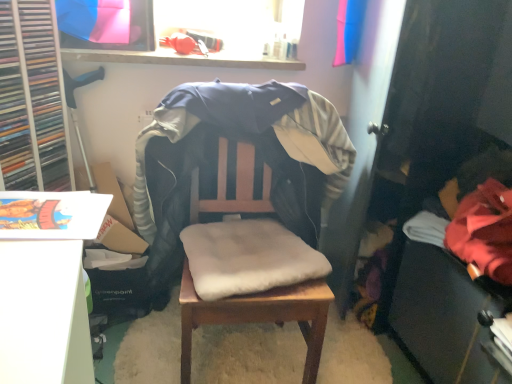
Where is `wooden chair with cushion at center`? The image size is (512, 384). wooden chair with cushion at center is located at coordinates (259, 316).

The image size is (512, 384). I want to click on soft beige cushion at center, so click(x=237, y=140).

The image size is (512, 384). Describe the element at coordinates (484, 231) in the screenshot. I see `red fleece jacket at lower right` at that location.

What is the approximate height of red fleece jacket at lower right?

red fleece jacket at lower right is 22.79 centimeters tall.

Find the location of a particular element. The width and height of the screenshot is (512, 384). wooden table at center is located at coordinates (259, 316).

From the image's perspective, does red fleece jacket at lower right appear lower than wooden chair with cushion at center?

Actually, red fleece jacket at lower right appears above wooden chair with cushion at center in the image.

Is red fleece jacket at lower right not inside wooden chair with cushion at center?

Yes.

Between point (481, 193) and point (305, 304), which one is positioned behind?

Positioned behind is point (481, 193).

Locate an element on the screen. The width and height of the screenshot is (512, 384). bean bag chair above the red fleece jacket at lower right (from the image's perspective) is located at coordinates (237, 140).

Is red fleece jacket at lower right facing away from soft beige cushion at center?

No, soft beige cushion at center is not at the back of red fleece jacket at lower right.

Can you confirm if red fleece jacket at lower right is positioned to the left of soft beige cushion at center?

Incorrect, red fleece jacket at lower right is not on the left side of soft beige cushion at center.

Is red fleece jacket at lower right not close to soft beige cushion at center?

That's not correct — red fleece jacket at lower right is a little close to soft beige cushion at center.

From a real-world perspective, is wooden table at center physically located above or below soft beige cushion at center?

Clearly, from a real-world perspective, wooden table at center is below soft beige cushion at center.

The image size is (512, 384). What are the coordinates of `table below the soft beige cushion at center (from a real-world perspective)` in the screenshot? It's located at (259, 316).

Considering the positions of point (269, 300) and point (318, 113), is point (269, 300) closer or farther from the camera than point (318, 113)?

Point (269, 300) is positioned closer to the camera compared to point (318, 113).

From the image's perspective, would you say wooden table at center is positioned over soft beige cushion at center?

Incorrect, from the image's perspective, wooden table at center is lower than soft beige cushion at center.

Is soft beige cushion at center touching red fleece jacket at lower right?

No.

Between soft beige cushion at center and red fleece jacket at lower right, which one has more height?

Standing taller between the two is soft beige cushion at center.

Is red fleece jacket at lower right at the back of soft beige cushion at center?

No, soft beige cushion at center's orientation is not away from red fleece jacket at lower right.

From a real-world perspective, which is physically above, soft beige cushion at center or red fleece jacket at lower right?

red fleece jacket at lower right.

From the image's perspective, who appears lower, soft beige cushion at center or wooden chair with cushion at center?

From the image's view, wooden chair with cushion at center is below.

Is soft beige cushion at center facing towards wooden chair with cushion at center?

Yes, soft beige cushion at center is oriented towards wooden chair with cushion at center.

Which of these two, soft beige cushion at center or wooden chair with cushion at center, is thinner?

With smaller width is soft beige cushion at center.

Is soft beige cushion at center with wooden chair with cushion at center?

No, soft beige cushion at center is not in contact with wooden chair with cushion at center.

Is point (160, 252) less distant than point (223, 306)?

That is False.

Based on the photo, does soft beige cushion at center come in front of wooden table at center?

Yes, soft beige cushion at center is in front of wooden table at center.

From a real-world perspective, between soft beige cushion at center and wooden table at center, who is vertically lower?

wooden table at center, from a real-world perspective.

Are soft beige cushion at center and wooden table at center located far from each other?

No, there isn't a large distance between soft beige cushion at center and wooden table at center.

Considering the sizes of objects wooden chair with cushion at center and wooden table at center in the image provided, who is shorter, wooden chair with cushion at center or wooden table at center?

wooden table at center is shorter.

Are wooden chair with cushion at center and wooden table at center far apart?

No.

Considering the relative sizes of wooden chair with cushion at center and wooden table at center in the image provided, is wooden chair with cushion at center smaller than wooden table at center?

Actually, wooden chair with cushion at center might be larger than wooden table at center.

Is wooden chair with cushion at center at the left side of wooden table at center?

No, wooden chair with cushion at center is not to the left of wooden table at center.

You are a GUI agent. You are given a task and a screenshot of the screen. Output one action in this format:
    pyautogui.click(x=<x>, y=<y>)
    Task: Click on the chair below the red fleece jacket at lower right (from the image's perspective)
    The image size is (512, 384).
    Given the screenshot: What is the action you would take?
    pyautogui.click(x=259, y=316)

Find the location of a particular element. bean bag chair on the left of red fleece jacket at lower right is located at coordinates (237, 140).

Looking at the image, which one is located closer to soft beige cushion at center, wooden table at center or wooden chair with cushion at center?

wooden table at center is closer to soft beige cushion at center.

Looking at the image, which one is located closer to wooden chair with cushion at center, wooden table at center or soft beige cushion at center?

Based on the image, wooden table at center appears to be nearer to wooden chair with cushion at center.

Looking at the image, which one is located closer to wooden table at center, red fleece jacket at lower right or soft beige cushion at center?

soft beige cushion at center lies closer to wooden table at center than the other object.

When comparing their distances from soft beige cushion at center, does red fleece jacket at lower right or wooden table at center seem further?

The object further to soft beige cushion at center is red fleece jacket at lower right.

From the image, which object appears to be nearer to wooden table at center, red fleece jacket at lower right or wooden chair with cushion at center?

wooden chair with cushion at center.

Considering their positions, is red fleece jacket at lower right positioned closer to wooden chair with cushion at center than wooden table at center?

wooden table at center.

Considering their positions, is wooden chair with cushion at center positioned closer to wooden table at center than red fleece jacket at lower right?

wooden chair with cushion at center is closer to wooden table at center.

Estimate the real-world distances between objects in this image. Which object is further from wooden chair with cushion at center, soft beige cushion at center or wooden table at center?

soft beige cushion at center.

Identify the location of chair located between soft beige cushion at center and red fleece jacket at lower right in the left-right direction. This screenshot has height=384, width=512. (259, 316).

This screenshot has width=512, height=384. What are the coordinates of `table between soft beige cushion at center and red fleece jacket at lower right` in the screenshot? It's located at (259, 316).

This screenshot has width=512, height=384. I want to click on chair between soft beige cushion at center and wooden table at center in the vertical direction, so click(259, 316).

I want to click on chair between wooden table at center and red fleece jacket at lower right, so click(259, 316).